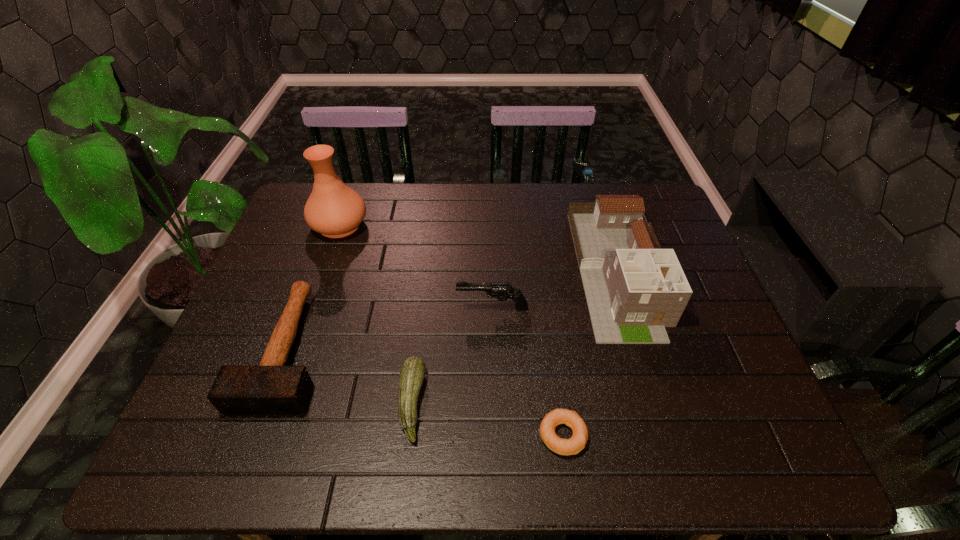
The image size is (960, 540). What are the coordinates of `vacant region located at the end of the barrel of the gun` in the screenshot? It's located at (430, 308).

Locate an element on the screen. The height and width of the screenshot is (540, 960). vacant space located 0.180m at the end of the barrel of the gun is located at coordinates (388, 308).

Identify the location of free point located at the end of the barrel of the gun. The image size is (960, 540). (399, 308).

This screenshot has width=960, height=540. Identify the location of free point located on the hammer head face of the third shortest object. (250, 453).

The height and width of the screenshot is (540, 960). Find the location of `free space located at the stem end of the second shortest object`. free space located at the stem end of the second shortest object is located at coordinates (484, 402).

Identify the location of free space located on the left of the bagel. (500, 435).

Locate an element on the screen. Image resolution: width=960 pixels, height=540 pixels. vase at the far edge is located at coordinates coord(333,209).

Where is `dollhouse positioned at the far edge`? dollhouse positioned at the far edge is located at coordinates (634, 289).

Identify the location of zucchini at the near edge. The image size is (960, 540). (412, 373).

At what (x,y) coordinates should I click in order to perform the action: click on bagel present at the near edge. Please return your answer as a coordinate pair (x, y). This screenshot has width=960, height=540. Looking at the image, I should click on (572, 446).